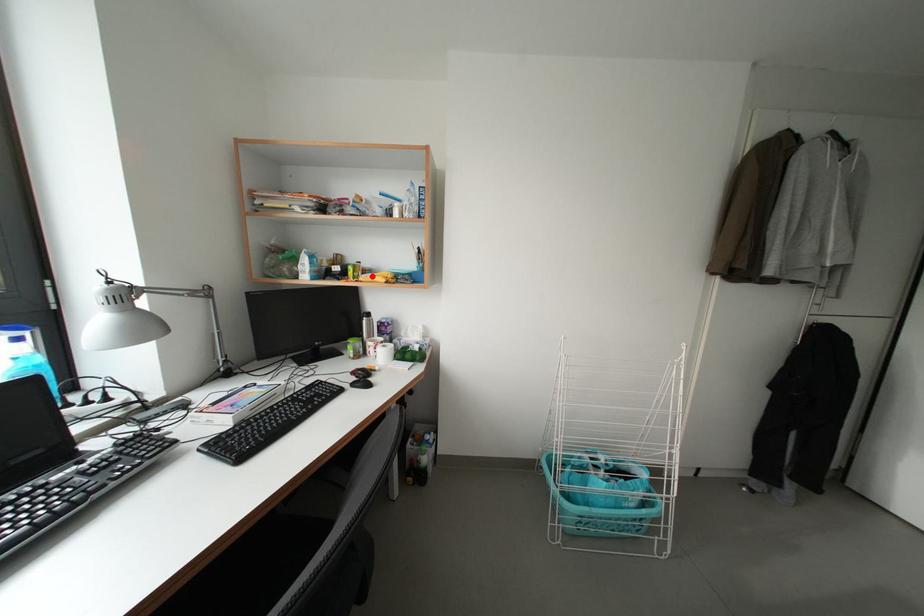
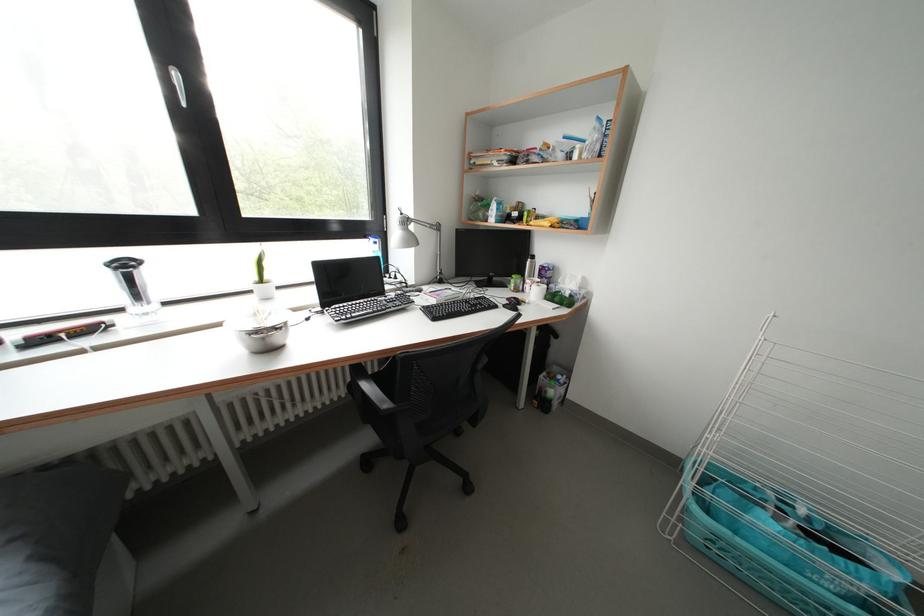
In the second image, find the point that corresponds to the highlighted location in the first image.

(544, 223)